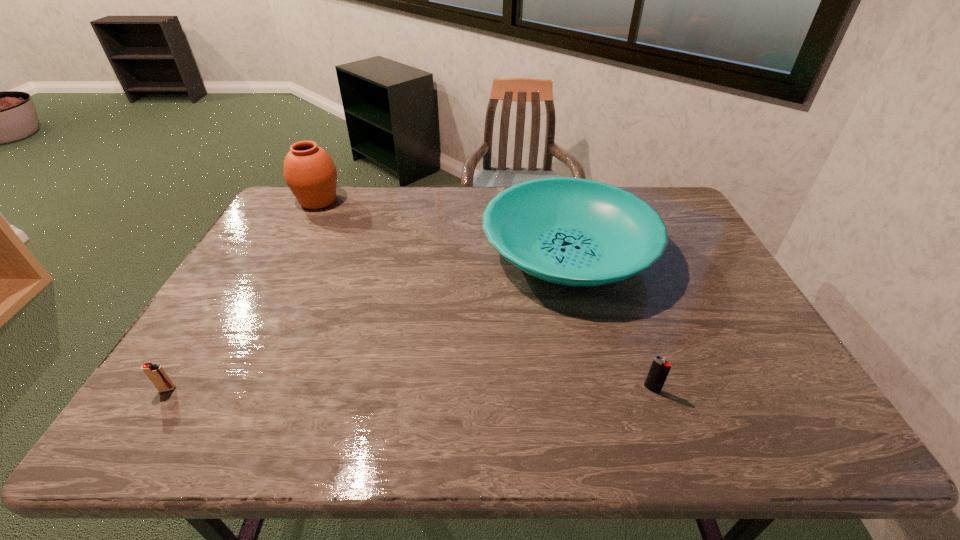
Where is `vacant region located on the back of the left igniter`? This screenshot has height=540, width=960. vacant region located on the back of the left igniter is located at coordinates (198, 342).

Image resolution: width=960 pixels, height=540 pixels. In order to click on urn located at the far edge in this screenshot , I will do `click(309, 171)`.

You are a GUI agent. You are given a task and a screenshot of the screen. Output one action in this format:
    pyautogui.click(x=<x>, y=<y>)
    Task: Click on the dish positioned at the far edge
    Image resolution: width=960 pixels, height=540 pixels.
    Given the screenshot: What is the action you would take?
    pyautogui.click(x=571, y=231)

Where is `urn that is at the left edge`? The image size is (960, 540). urn that is at the left edge is located at coordinates (309, 171).

Locate an element on the screen. igniter that is at the left edge is located at coordinates (157, 375).

At what (x,y) coordinates should I click in order to perform the action: click on object present at the far left corner. Please return your answer as a coordinate pair (x, y). The width and height of the screenshot is (960, 540). Looking at the image, I should click on (309, 171).

In the image, there is a desktop. Where is `free region at the far edge`? free region at the far edge is located at coordinates (432, 198).

At what (x,y) coordinates should I click in order to perform the action: click on vacant region at the left edge of the desktop. Please return your answer as a coordinate pair (x, y). Looking at the image, I should click on coord(279,234).

In order to click on free space at the right edge in this screenshot , I will do `click(718, 284)`.

This screenshot has height=540, width=960. In order to click on free region at the near left corner in this screenshot , I will do `click(204, 416)`.